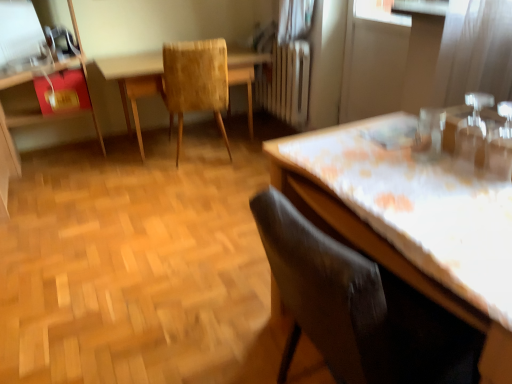
Question: Is textured beige chair at center, which is counted as the first chair, starting from the back, looking in the opposite direction of white floral tablecloth at right?

Choices:
 (A) yes
 (B) no

Answer: (A)

Question: Is textured beige chair at center, acting as the first chair starting from the top, at the right side of white floral tablecloth at right?

Choices:
 (A) no
 (B) yes

Answer: (A)

Question: Can you confirm if textured beige chair at center, which appears as the second chair when viewed from the right, is thinner than white floral tablecloth at right?

Choices:
 (A) yes
 (B) no

Answer: (B)

Question: From a real-world perspective, does textured beige chair at center, acting as the first chair starting from the top, stand above white floral tablecloth at right?

Choices:
 (A) no
 (B) yes

Answer: (B)

Question: Considering the relative sizes of textured beige chair at center, which appears as the second chair when viewed from the right, and white floral tablecloth at right in the image provided, is textured beige chair at center, which appears as the second chair when viewed from the right, taller than white floral tablecloth at right?

Choices:
 (A) yes
 (B) no

Answer: (A)

Question: Is textured beige chair at center, which is the 2th chair from front to back, next to white floral tablecloth at right?

Choices:
 (A) no
 (B) yes

Answer: (A)

Question: From a real-world perspective, is textured beige chair at center, acting as the first chair starting from the top, physically below transparent plastic screen door at upper right?

Choices:
 (A) yes
 (B) no

Answer: (A)

Question: Is textured beige chair at center, which is the 2th chair from front to back, aimed at transparent plastic screen door at upper right?

Choices:
 (A) no
 (B) yes

Answer: (A)

Question: Is textured beige chair at center, acting as the first chair starting from the top, beside transparent plastic screen door at upper right?

Choices:
 (A) no
 (B) yes

Answer: (A)

Question: Can you confirm if textured beige chair at center, which is the 2th chair from bottom to top, is taller than transparent plastic screen door at upper right?

Choices:
 (A) yes
 (B) no

Answer: (B)

Question: Is textured beige chair at center, acting as the first chair starting from the top, thinner than transparent plastic screen door at upper right?

Choices:
 (A) no
 (B) yes

Answer: (A)

Question: Can you confirm if textured beige chair at center, which appears as the second chair when viewed from the right, is shorter than transparent plastic screen door at upper right?

Choices:
 (A) no
 (B) yes

Answer: (B)

Question: Considering the relative sizes of matte red dresser at left and wooden textured table at center in the image provided, is matte red dresser at left smaller than wooden textured table at center?

Choices:
 (A) no
 (B) yes

Answer: (A)